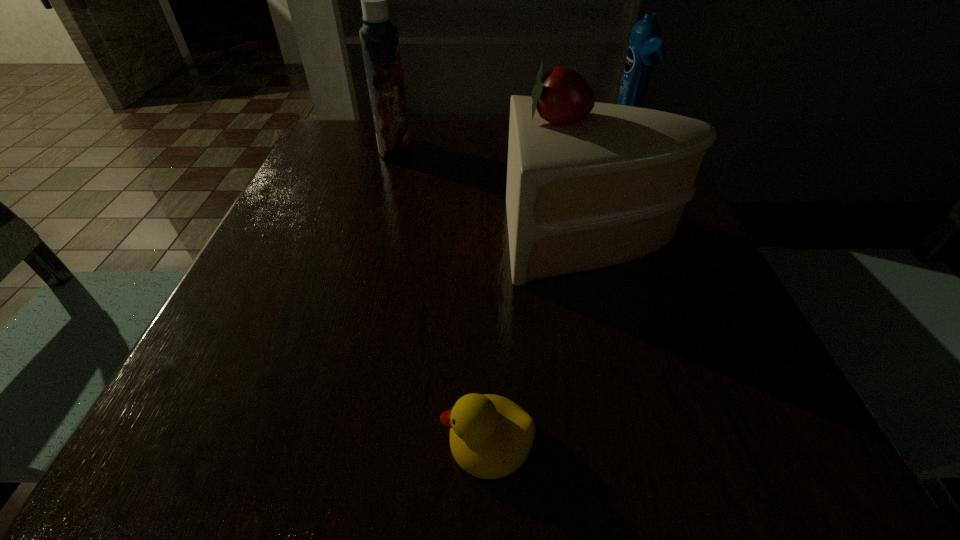
This screenshot has width=960, height=540. In order to click on object situated at the near right corner in this screenshot , I will do `click(739, 433)`.

Locate an element on the screen. Image resolution: width=960 pixels, height=540 pixels. vacant space at the far edge of the desktop is located at coordinates (468, 118).

In the image, there is a desktop. At what (x,y) coordinates should I click in order to perform the action: click on vacant region at the near edge. Please return your answer as a coordinate pair (x, y). Looking at the image, I should click on click(363, 433).

This screenshot has height=540, width=960. In the image, there is a desktop. Identify the location of vacant space at the left edge. (264, 226).

In the image, there is a desktop. Where is `free space at the right edge`? Image resolution: width=960 pixels, height=540 pixels. free space at the right edge is located at coordinates pyautogui.click(x=639, y=292).

Find the location of a particular element. The height and width of the screenshot is (540, 960). vacant space at the far left corner is located at coordinates (323, 119).

This screenshot has height=540, width=960. Find the location of `vacant region at the far right corner of the desktop`. vacant region at the far right corner of the desktop is located at coordinates (591, 151).

In the image, there is a desktop. Identify the location of vacant space at the near right corner. (777, 426).

The width and height of the screenshot is (960, 540). I want to click on vacant point located between the smallest gray watch and the leftmost gray watch, so click(610, 336).

You are a GUI agent. You are given a task and a screenshot of the screen. Output one action in this format:
    pyautogui.click(x=<x>, y=<y>)
    Task: Click on the free space between the smallest gold watch and the hourglass
    The height and width of the screenshot is (540, 960).
    Given the screenshot: What is the action you would take?
    pyautogui.click(x=444, y=288)